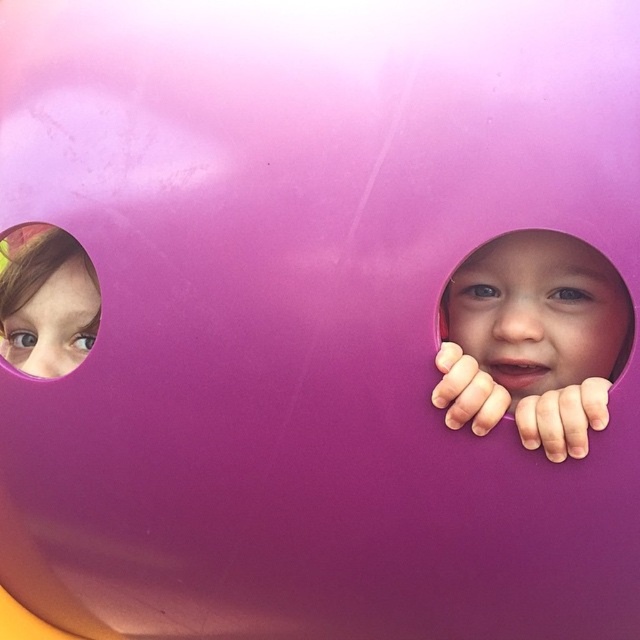
Which is more to the left, matte purple face at right or pink matte hole at upper left?

pink matte hole at upper left is more to the left.

Can you confirm if matte purple face at right is shorter than pink matte hole at upper left?

Incorrect, matte purple face at right's height does not fall short of pink matte hole at upper left's.

Find the location of a particular element. matte purple face at right is located at coordinates (532, 339).